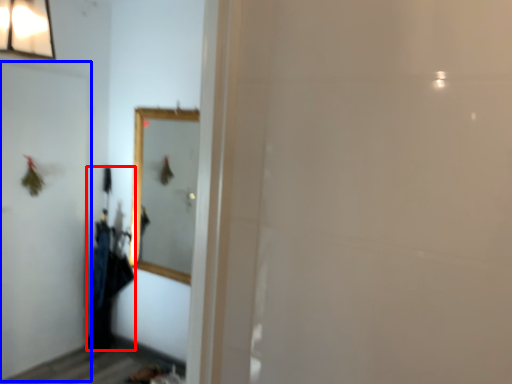
Question: Which object is further to the camera taking this photo, laundry (highlighted by a red box) or screen door (highlighted by a blue box)?

Choices:
 (A) laundry
 (B) screen door

Answer: (A)